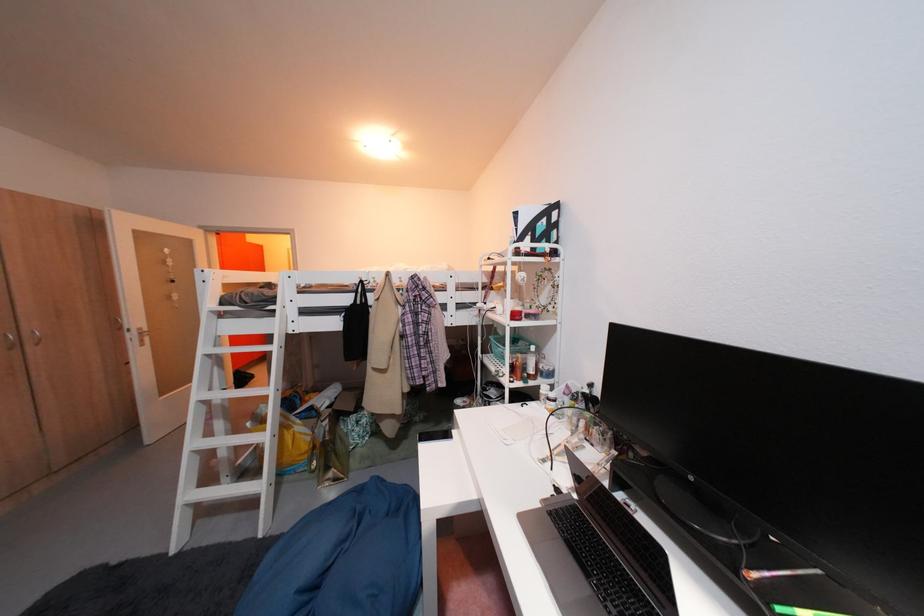
Find where to lift the white bottle. Please return your answer as a coordinate pair (x, y).

(531, 363)